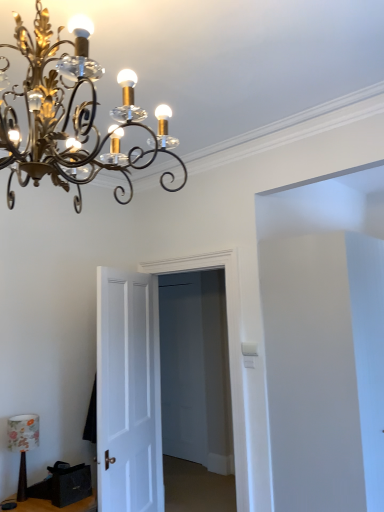
Question: Is black leather drawer at lower left not close to gold metallic chandelier at upper left, which ranks as the 2th lamp in back-to-front order?

Choices:
 (A) no
 (B) yes

Answer: (B)

Question: Is black leather drawer at lower left beside gold metallic chandelier at upper left, which is the first lamp from front to back?

Choices:
 (A) no
 (B) yes

Answer: (A)

Question: Can you confirm if black leather drawer at lower left is positioned to the left of gold metallic chandelier at upper left, the first lamp viewed from the right?

Choices:
 (A) yes
 (B) no

Answer: (A)

Question: Is gold metallic chandelier at upper left, the first lamp viewed from the top, completely or partially inside black leather drawer at lower left?

Choices:
 (A) yes
 (B) no

Answer: (B)

Question: Is black leather drawer at lower left closer to camera compared to gold metallic chandelier at upper left, the 2th lamp in the bottom-to-top sequence?

Choices:
 (A) yes
 (B) no

Answer: (B)

Question: Is point (74, 470) positioned closer to the camera than point (24, 441)?

Choices:
 (A) closer
 (B) farther

Answer: (A)

Question: Is black leather drawer at lower left situated inside floral fabric lampshade at lower left, placed as the first lamp when sorted from left to right, or outside?

Choices:
 (A) outside
 (B) inside

Answer: (A)

Question: From the image's perspective, relative to floral fabric lampshade at lower left, acting as the first lamp starting from the back, is black leather drawer at lower left above or below?

Choices:
 (A) below
 (B) above

Answer: (A)

Question: Considering the relative positions of black leather drawer at lower left and floral fabric lampshade at lower left, arranged as the second lamp when viewed from the front, in the image provided, is black leather drawer at lower left to the left or to the right of floral fabric lampshade at lower left, arranged as the second lamp when viewed from the front,?

Choices:
 (A) left
 (B) right

Answer: (B)

Question: Looking at their shapes, would you say black fabric speaker at lower left is wider or thinner than white wooden door at center, positioned as the 2th door in left-to-right order?

Choices:
 (A) wide
 (B) thin

Answer: (A)

Question: Do you think black fabric speaker at lower left is within white wooden door at center, positioned as the 2th door in left-to-right order, or outside of it?

Choices:
 (A) inside
 (B) outside

Answer: (B)

Question: Considering the positions of black fabric speaker at lower left and white wooden door at center, positioned as the 2th door in left-to-right order, in the image, is black fabric speaker at lower left taller or shorter than white wooden door at center, positioned as the 2th door in left-to-right order,?

Choices:
 (A) tall
 (B) short

Answer: (B)

Question: Does point (48, 508) appear closer or farther from the camera than point (160, 477)?

Choices:
 (A) farther
 (B) closer

Answer: (B)

Question: Is white wooden door at center, positioned as the 2th door in left-to-right order, in front of or behind floral fabric lampshade at lower left, arranged as the second lamp when viewed from the front, in the image?

Choices:
 (A) behind
 (B) front

Answer: (A)

Question: From the image's perspective, relative to floral fabric lampshade at lower left, the 2th lamp in the right-to-left sequence, is white wooden door at center, positioned as the 2th door in left-to-right order, above or below?

Choices:
 (A) above
 (B) below

Answer: (A)